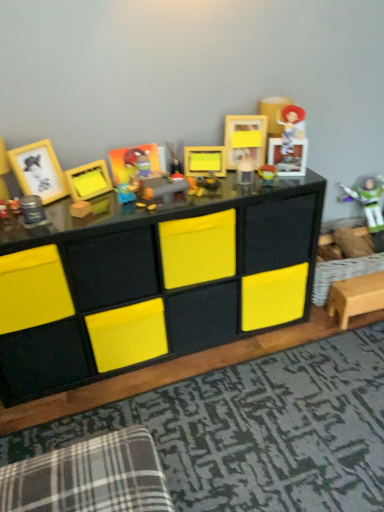
Question: In terms of width, does matte yellow plush toy at center, marked as the 4th toy in a right-to-left arrangement, look wider or thinner when compared to plaid fabric swivel chair at lower left?

Choices:
 (A) wide
 (B) thin

Answer: (B)

Question: Considering the relative positions of matte yellow plush toy at center, acting as the second toy starting from the front, and plaid fabric swivel chair at lower left in the image provided, is matte yellow plush toy at center, acting as the second toy starting from the front, to the left or to the right of plaid fabric swivel chair at lower left?

Choices:
 (A) left
 (B) right

Answer: (B)

Question: Which object is positioned closest to the matte yellow picture frame at left, marked as the first picture frame in a left-to-right arrangement?

Choices:
 (A) metallic silver canister at left, the first toy when ordered from front to back
 (B) black matte storage unit at center
 (C) matte plastic picture frame at center, the third picture frame viewed from the right
 (D) plastic buzz lightyear at right, the fifth toy viewed from the left
 (E) matte yellow plush toy at center, marked as the 4th toy in a right-to-left arrangement

Answer: (A)

Question: Estimate the real-world distances between objects in this image. Which object is farther from the metallic silver canister at left, the first toy when ordered from front to back?

Choices:
 (A) plaid fabric swivel chair at lower left
 (B) matte plastic buzz lightyear at center, which is the third toy in front-to-back order
 (C) matte plastic picture frame at center, the third picture frame viewed from the right
 (D) matte yellow picture frame at left, marked as the first picture frame in a left-to-right arrangement
 (E) plastic buzz lightyear at right, which appears as the fifth toy when viewed from the front

Answer: (E)